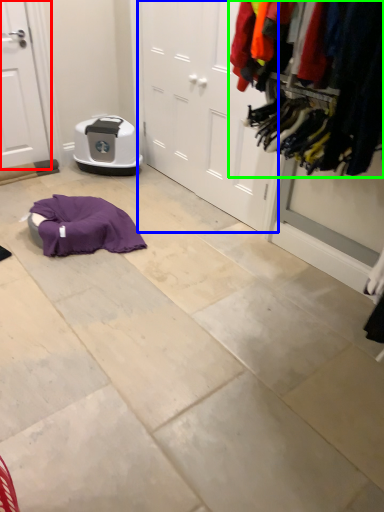
Question: Considering the real-world distances, which object is closest to door (highlighted by a red box)? door (highlighted by a blue box) or closet (highlighted by a green box).

Choices:
 (A) door
 (B) closet

Answer: (A)